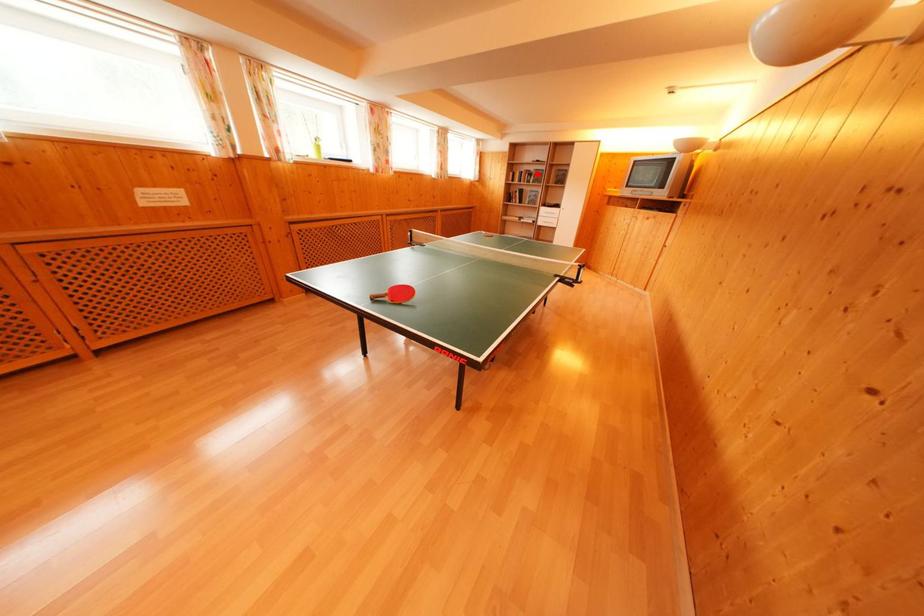
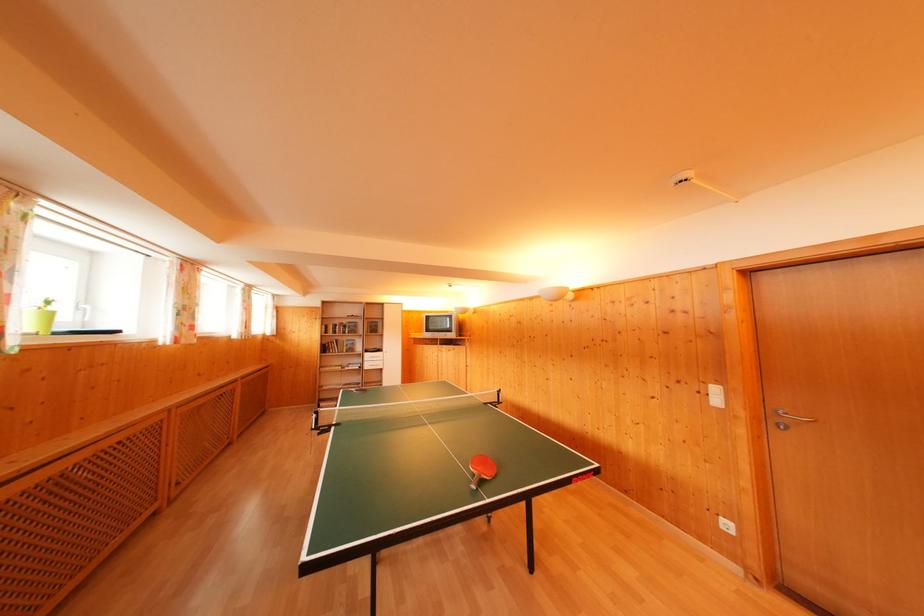
Question: I am providing you with two images of the same scene from different viewpoints. In image1, a red point is highlighted. Considering the same 3D point in image2, which of the following is correct?

Choices:
 (A) It is closer
 (B) It is farther

Answer: (B)